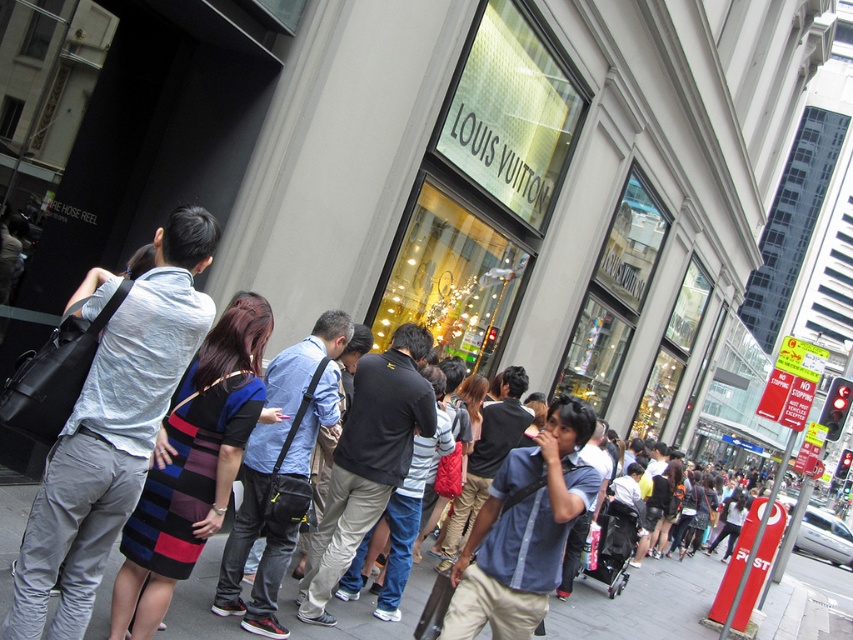
You are standing on the smooth concrete pavement at center and want to move to the blue striped dress at center. Which direction should you move?

The smooth concrete pavement at center is to the right of the blue striped dress at center, so you should move to the left to reach it.

In the scene shown: You are a photographer standing in front of the Louis Vuitton store. You want to take a photo of the blue striped dress at center and the glassy gold display at center. Which object should you focus on first to ensure both are in sharp focus?

The blue striped dress at center is closer to the viewer than the glassy gold display at center. To ensure both are in sharp focus, you should focus on the blue striped dress at center first, as it is the closer object.

You are a delivery person carrying a package that requires a 5 meter clearance to pass through a narrow alleyway. You see the blue denim shirt at center and the glassy gold display at center in the scene. Can you safely navigate through the space between them without hitting either object?

The distance between the blue denim shirt at center and the glassy gold display at center is 4.98 meters. Since the required clearance is 5 meters, the delivery person cannot safely navigate through the space between them without hitting either object.